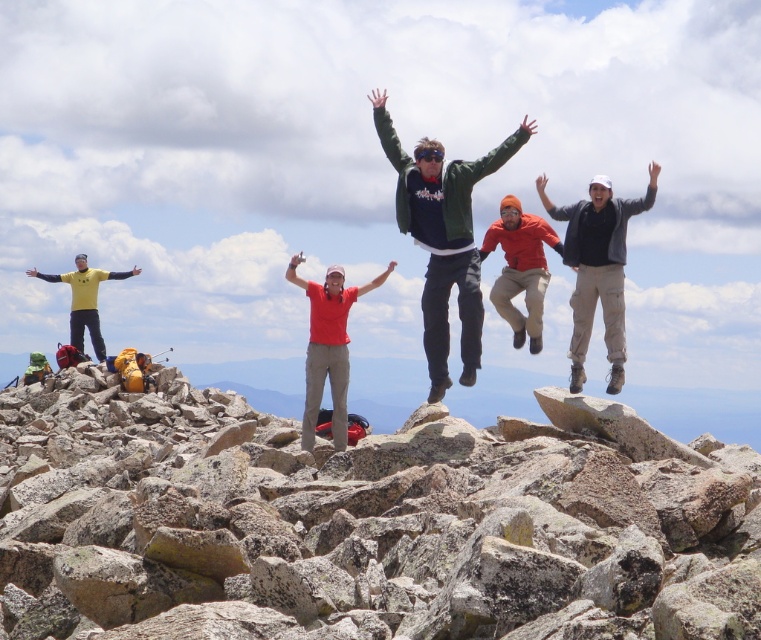
You are standing at the origin point of the image coordinate system. You see a group of people celebrating on a rocky summit. There is an orange fabric jacket at center located at point [521,268]. If you want to move towards the orange fabric jacket at center, which direction should you move in terms of the coordinate system?

To move towards the orange fabric jacket at center located at point [521,268], you should move in the positive x and positive y direction since the coordinates are higher than the origin at 0,0.

In the scene shown: You are a photographer trying to capture a group photo of the gray speckled rock at center and the yellow matte shirt at left. The camera can only focus on objects within a 3 meter width. Can you fit both subjects into the frame without moving the camera?

The gray speckled rock at center might be wider than yellow matte shirt at left, so the total width of both subjects could exceed the camera focus limit. It might not fit both into the frame.